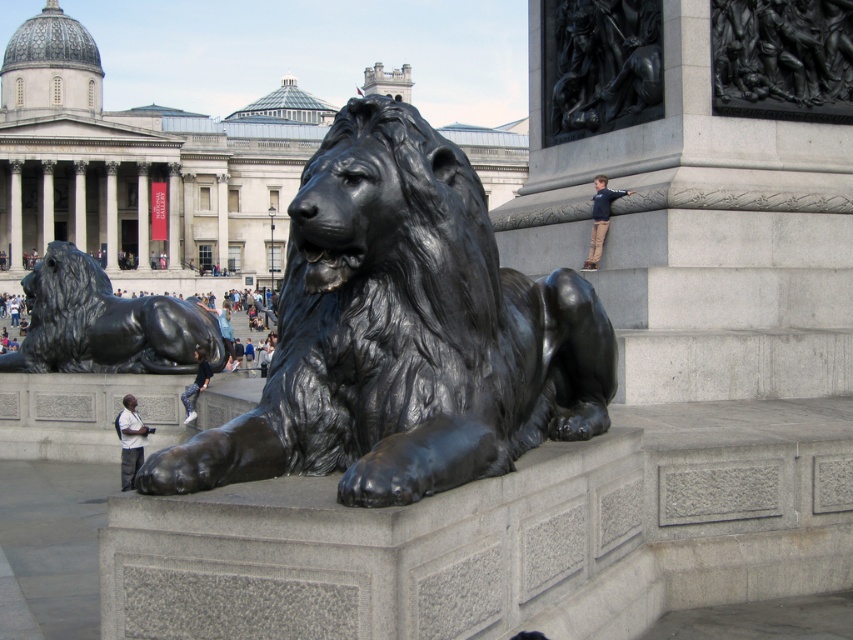
Is polished bronze lion at lower left thinner than polished bronze figures at upper right?

In fact, polished bronze lion at lower left might be wider than polished bronze figures at upper right.

Where is `polished bronze lion at lower left`? The height and width of the screenshot is (640, 853). polished bronze lion at lower left is located at coordinates (105, 323).

Where is `polished bronze lion at lower left`? The width and height of the screenshot is (853, 640). polished bronze lion at lower left is located at coordinates tap(105, 323).

Who is lower down, polished bronze figures at upper right or denim pants at lower left?

denim pants at lower left

Can you confirm if polished bronze figures at upper right is positioned below denim pants at lower left?

No, polished bronze figures at upper right is not below denim pants at lower left.

Does point (582, 20) lie behind point (206, 374)?

No, it is not.

Identify the location of polished bronze figures at upper right. The width and height of the screenshot is (853, 640). coord(599,65).

Who is positioned more to the right, light gray shirt at lower left or denim pants at lower left?

From the viewer's perspective, denim pants at lower left appears more on the right side.

Between light gray shirt at lower left and denim pants at lower left, which one has more height?

light gray shirt at lower left is taller.

Is point (123, 419) in front of point (204, 374)?

Yes, it is in front of point (204, 374).

At what (x,y) coordinates should I click in order to perform the action: click on light gray shirt at lower left. Please return your answer as a coordinate pair (x, y). This screenshot has width=853, height=640. Looking at the image, I should click on (131, 440).